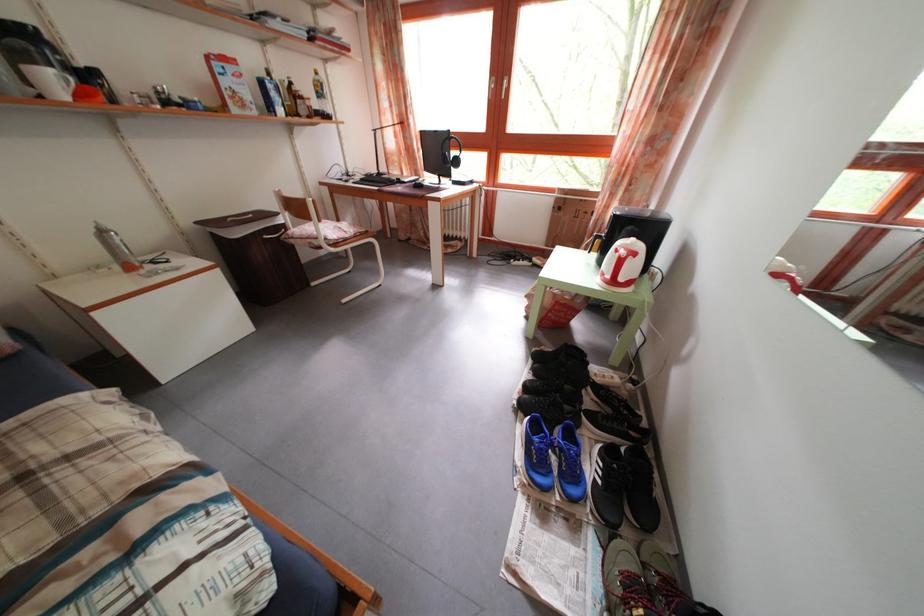
Where would you press the silver spray can? Please return your answer as a coordinate pair (x, y).

(116, 248)